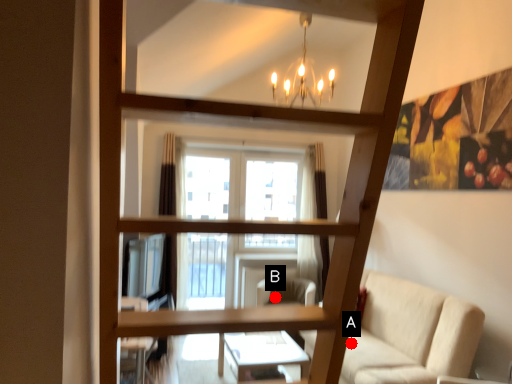
Question: Two points are circled on the image, labeled by A and B beside each circle. Among these points, which one is nearest to the camera?

Choices:
 (A) A is closer
 (B) B is closer

Answer: (A)